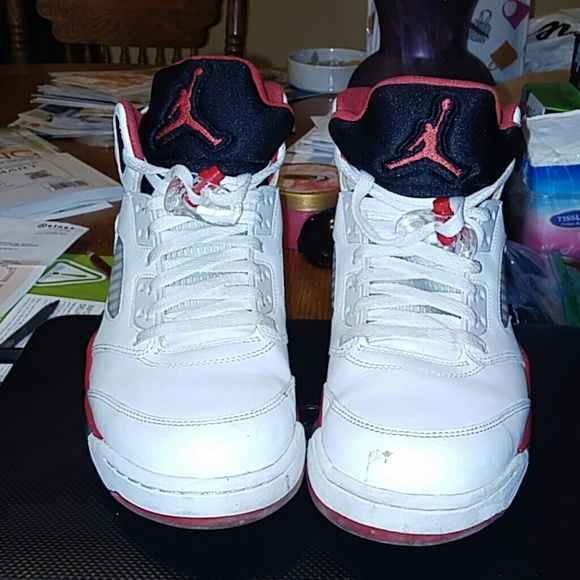
You are a GUI agent. You are given a task and a screenshot of the screen. Output one action in this format:
    pyautogui.click(x=<x>, y=<y>)
    Task: Click on the round white dish
    Image resolution: width=580 pixels, height=580 pixels.
    Given the screenshot: What is the action you would take?
    pyautogui.click(x=314, y=66)